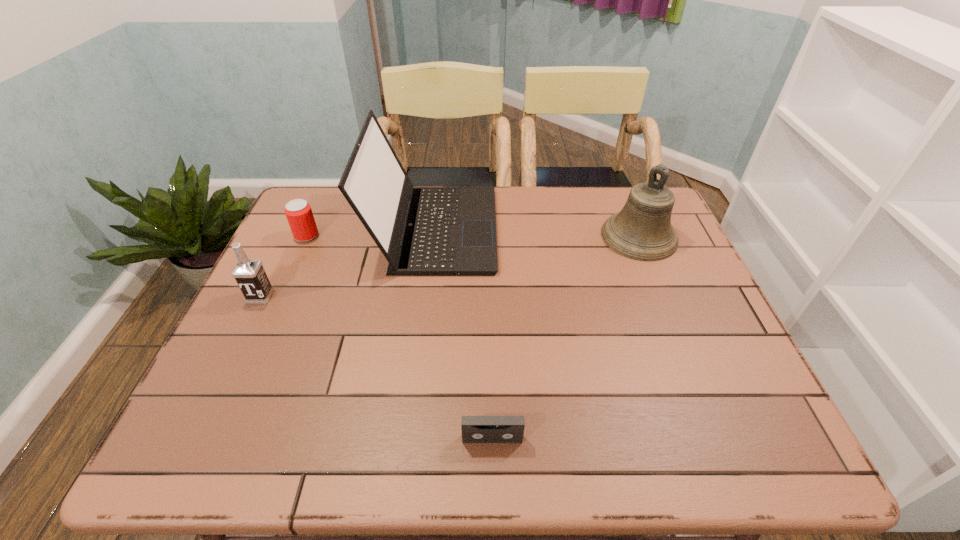
I want to click on object positioned at the far right corner, so click(642, 230).

Find the location of a particular element. The image size is (960, 540). free spot at the far edge of the desktop is located at coordinates (561, 204).

Identify the location of free region at the near edge of the desktop. (646, 448).

In the image, there is a desktop. What are the coordinates of `blank space at the left edge` in the screenshot? It's located at (200, 407).

You are a GUI agent. You are given a task and a screenshot of the screen. Output one action in this format:
    pyautogui.click(x=<x>, y=<y>)
    Task: Click on the vacant area at the right edge of the desktop
    
    Given the screenshot: What is the action you would take?
    pyautogui.click(x=684, y=266)

What are the coordinates of `vacant space at the far left corner of the desktop` in the screenshot? It's located at (326, 187).

Image resolution: width=960 pixels, height=540 pixels. Find the location of `vacant space at the near left corner of the desktop`. vacant space at the near left corner of the desktop is located at coordinates pos(220,447).

The image size is (960, 540). What are the coordinates of `vacant space that's between the videotape and the fourth tallest object` in the screenshot? It's located at (399, 337).

Find the location of a particular element. The width and height of the screenshot is (960, 540). vacant area that lies between the nearest object and the beer can is located at coordinates (399, 337).

Where is `free area in between the nearest object and the beer can`? The height and width of the screenshot is (540, 960). free area in between the nearest object and the beer can is located at coordinates (399, 337).